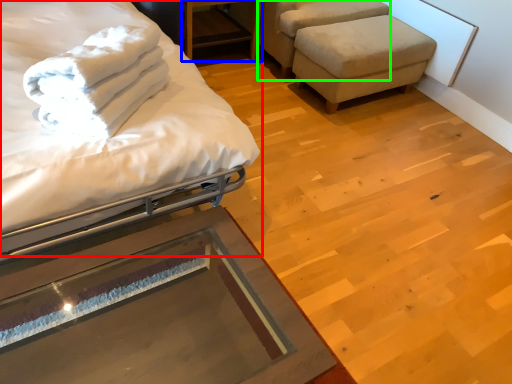
Question: Which object is positioned closest to bed (highlighted by a red box)? Select from table (highlighted by a blue box) and swivel chair (highlighted by a green box).

Choices:
 (A) table
 (B) swivel chair

Answer: (A)